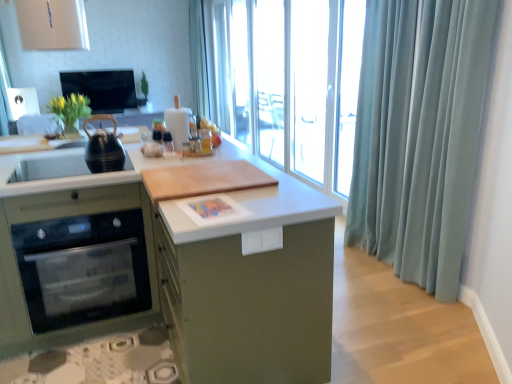
Question: Considering the relative positions of black matte kettle at left and light blue fabric at upper center, which is the 1th shower curtain from left to right, in the image provided, is black matte kettle at left to the right of light blue fabric at upper center, which is the 1th shower curtain from left to right, from the viewer's perspective?

Choices:
 (A) yes
 (B) no

Answer: (A)

Question: Can you confirm if black matte kettle at left is shorter than light blue fabric at upper center, which is counted as the first shower curtain, starting from the back?

Choices:
 (A) no
 (B) yes

Answer: (B)

Question: From a real-world perspective, is black matte kettle at left below light blue fabric at upper center, arranged as the second shower curtain when viewed from the right?

Choices:
 (A) yes
 (B) no

Answer: (A)

Question: Considering the relative sizes of black matte kettle at left and light blue fabric at upper center, which is counted as the first shower curtain, starting from the back, in the image provided, is black matte kettle at left taller than light blue fabric at upper center, which is counted as the first shower curtain, starting from the back,?

Choices:
 (A) yes
 (B) no

Answer: (B)

Question: From the image's perspective, is black matte kettle at left over light blue fabric at upper center, arranged as the second shower curtain when viewed from the right?

Choices:
 (A) no
 (B) yes

Answer: (A)

Question: In the image, is light blue fabric at upper center, which is the 1th shower curtain from left to right, on the left side or the right side of white glossy sink at left?

Choices:
 (A) right
 (B) left

Answer: (B)

Question: Considering the positions of light blue fabric at upper center, arranged as the second shower curtain when viewed from the front, and white glossy sink at left in the image, is light blue fabric at upper center, arranged as the second shower curtain when viewed from the front, taller or shorter than white glossy sink at left?

Choices:
 (A) tall
 (B) short

Answer: (A)

Question: Considering their positions, is light blue fabric at upper center, acting as the first shower curtain starting from the top, located in front of or behind white glossy sink at left?

Choices:
 (A) front
 (B) behind

Answer: (B)

Question: From a real-world perspective, is light blue fabric at upper center, acting as the first shower curtain starting from the top, physically located above or below white glossy sink at left?

Choices:
 (A) below
 (B) above

Answer: (B)

Question: Based on their sizes in the image, would you say wooden cutting board at center is bigger or smaller than light blue fabric at upper center, arranged as the second shower curtain when viewed from the front?

Choices:
 (A) big
 (B) small

Answer: (A)

Question: Is wooden cutting board at center in front of or behind light blue fabric at upper center, arranged as the second shower curtain when viewed from the front, in the image?

Choices:
 (A) front
 (B) behind

Answer: (A)

Question: From the image's perspective, is wooden cutting board at center positioned above or below light blue fabric at upper center, arranged as the second shower curtain when viewed from the right?

Choices:
 (A) below
 (B) above

Answer: (A)

Question: From a real-world perspective, is wooden cutting board at center physically located above or below light blue fabric at upper center, which is counted as the first shower curtain, starting from the back?

Choices:
 (A) above
 (B) below

Answer: (B)

Question: Considering the positions of satin blue curtain at right, which appears as the 1th shower curtain when ordered from the bottom, and light blue fabric at upper center, which is the 1th shower curtain from left to right, in the image, is satin blue curtain at right, which appears as the 1th shower curtain when ordered from the bottom, taller or shorter than light blue fabric at upper center, which is the 1th shower curtain from left to right,?

Choices:
 (A) tall
 (B) short

Answer: (B)

Question: Based on their positions, is satin blue curtain at right, the 1th shower curtain in the right-to-left sequence, located to the left or right of light blue fabric at upper center, which is counted as the first shower curtain, starting from the back?

Choices:
 (A) right
 (B) left

Answer: (A)